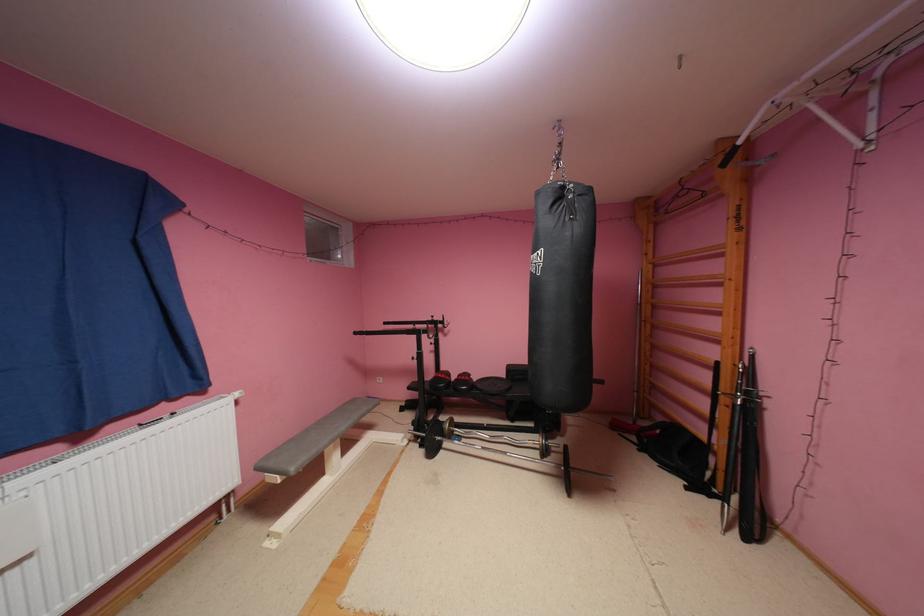
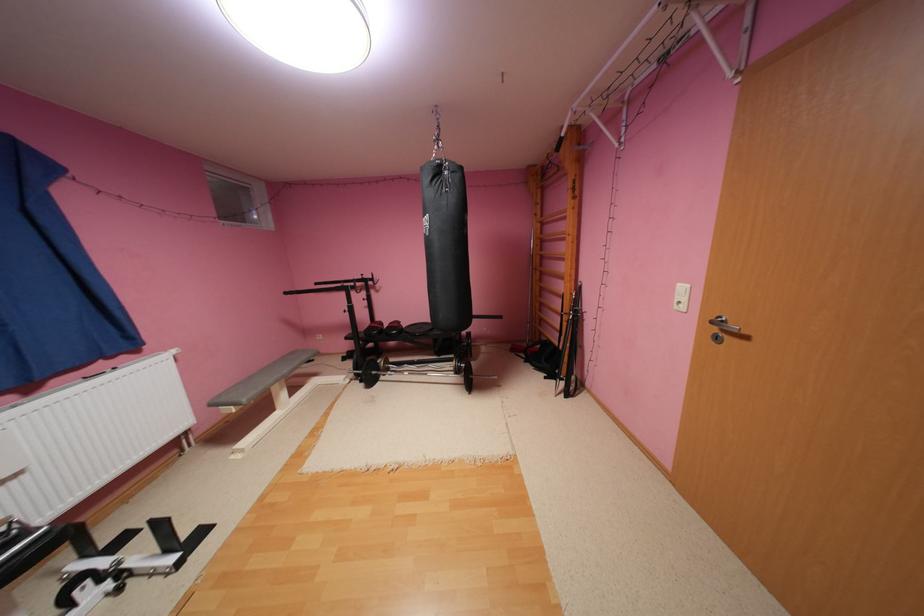
The point at (568, 193) is marked in the first image. Where is the corresponding point in the second image?

(446, 171)